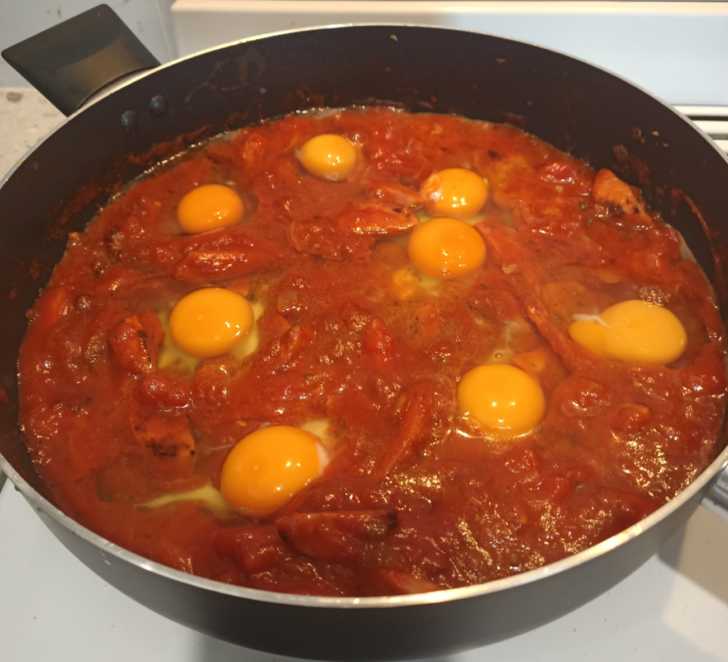
Find the location of a particular element. The width and height of the screenshot is (728, 662). only area in photo showing floor is located at coordinates (20, 124).